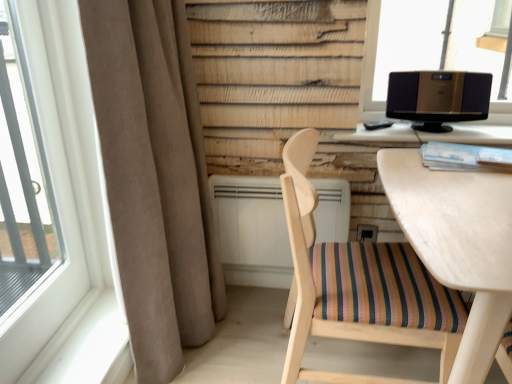
Where is `free space above black glossy monitor at upper right (from a real-world perspective)`? free space above black glossy monitor at upper right (from a real-world perspective) is located at coordinates (408, 122).